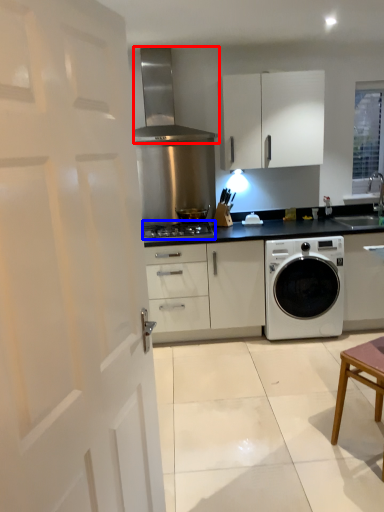
Question: Which of the following is the farthest to the observer, home appliance (highlighted by a red box) or gas stove (highlighted by a blue box)?

Choices:
 (A) home appliance
 (B) gas stove

Answer: (B)